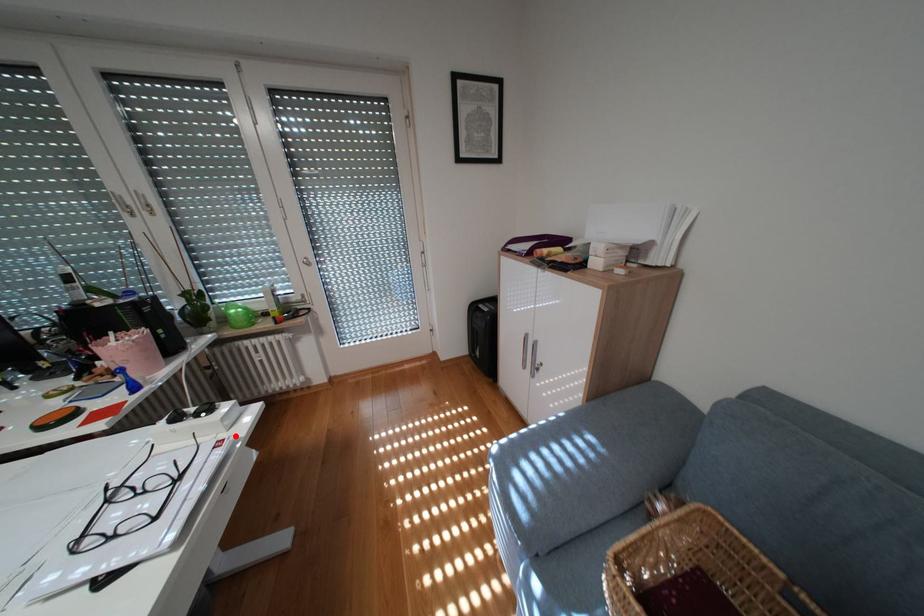
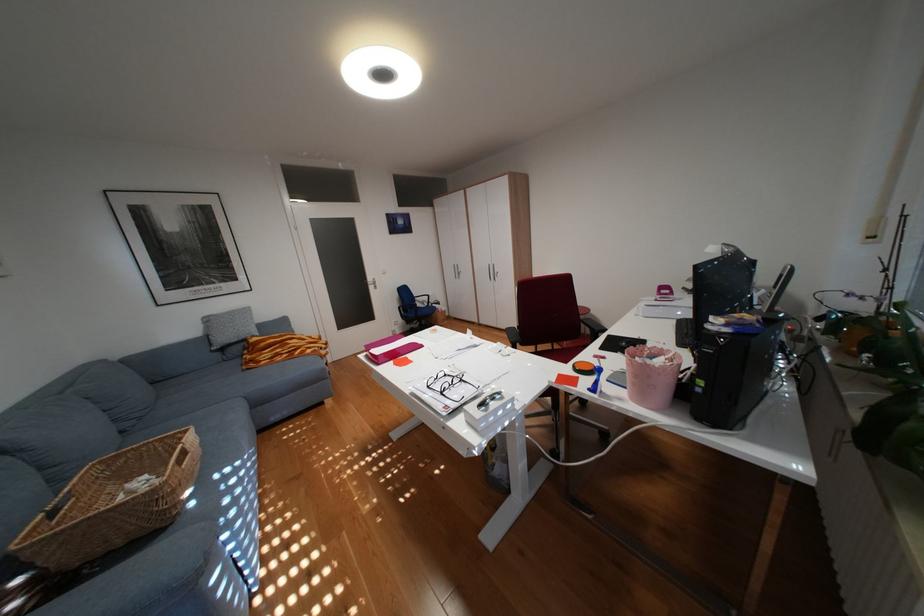
In the second image, find the point that corresponds to the highlighted location in the first image.

(473, 416)